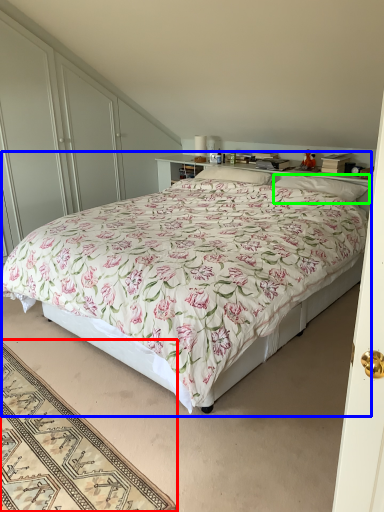
Question: Which object is positioned closest to mat (highlighted by a red box)? Select from bed (highlighted by a blue box) and pillow (highlighted by a green box).

Choices:
 (A) bed
 (B) pillow

Answer: (A)